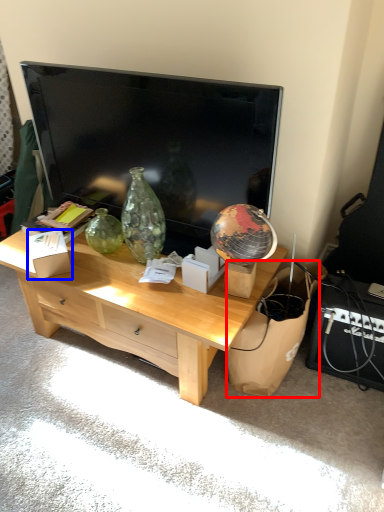
Question: Which point is closer to the camera, cardboard (highlighted by a red box) or cardboard box (highlighted by a blue box)?

Choices:
 (A) cardboard
 (B) cardboard box

Answer: (A)